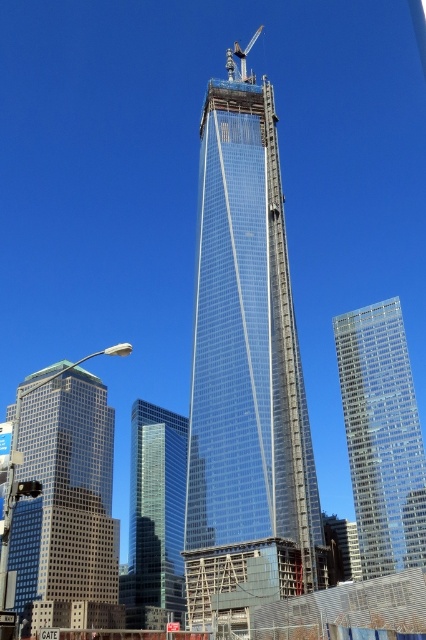
You are a construction worker standing at point (x=382, y=436). You need to move to the transparent glass building at right. Is the path clear? Please explain.

The path is clear because the point (x=382, y=436) is located at the transparent glass building at right, so you are already there.

From the picture: You are standing at the point marked by the coordinate point [71,483]. Looking around, you see the glassy reflective skyscraper at left. Which direction should you face to see the glassy reflective skyscraper at left?

You should face to the left to see the glassy reflective skyscraper at left since the point marks your location and the skyscraper is at the left side of the image.